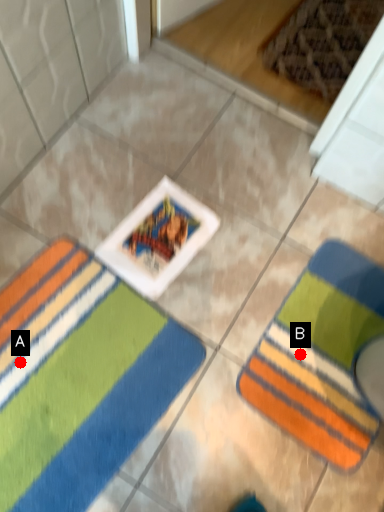
Question: Two points are circled on the image, labeled by A and B beside each circle. Which of the following is the farthest from the observer?

Choices:
 (A) A is further
 (B) B is further

Answer: (B)